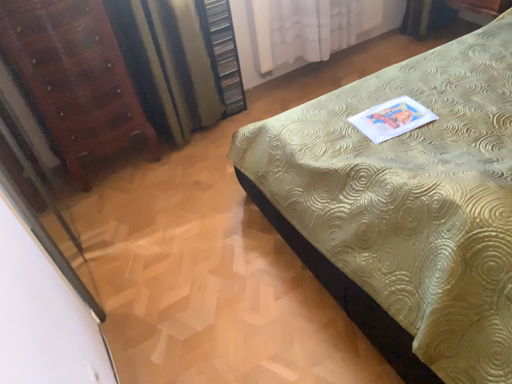
Identify the location of vacant space that's between mahogany wood dresser at left and transparent glass screen door at left. This screenshot has width=512, height=384. (122, 222).